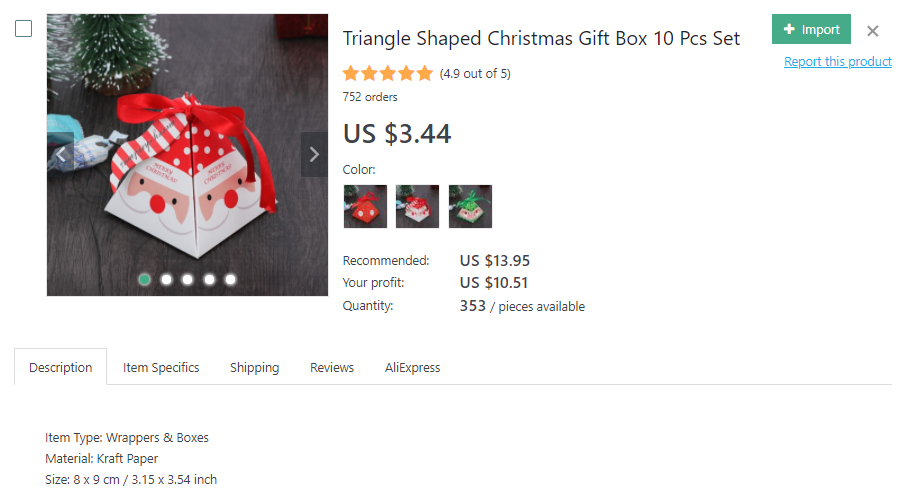
Find the location of a particular element. The height and width of the screenshot is (492, 905). floor is located at coordinates (272, 64).